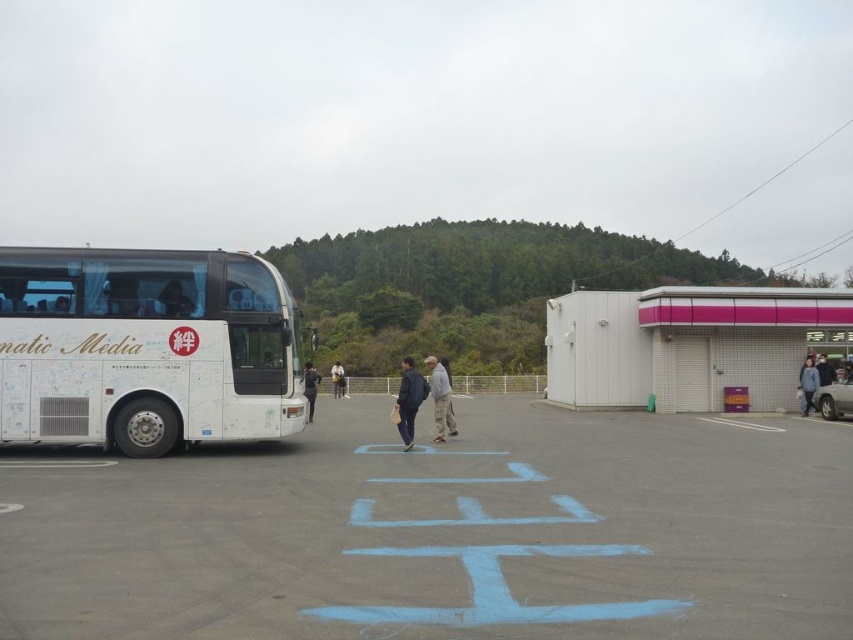
Which is more to the right, dark blue fabric jacket at center or dark gray fabric jacket at right?

From the viewer's perspective, dark gray fabric jacket at right appears more on the right side.

Which is more to the left, dark blue fabric jacket at center or dark gray fabric jacket at right?

dark blue fabric jacket at center is more to the left.

The width and height of the screenshot is (853, 640). I want to click on dark blue fabric jacket at center, so click(x=409, y=400).

Is white matte bus at left wider than black fabric jacket at center?

Correct, the width of white matte bus at left exceeds that of black fabric jacket at center.

Does white matte bus at left have a lesser width compared to black fabric jacket at center?

Incorrect, white matte bus at left's width is not less than black fabric jacket at center's.

Who is more forward, (74, 426) or (309, 388)?

Point (74, 426) is in front.

The width and height of the screenshot is (853, 640). I want to click on white matte bus at left, so click(x=144, y=348).

Between point (817, 461) and point (438, 408), which one is positioned in front?

Point (817, 461) is in front.

Which is above, white asphalt parking lot at center or gray camouflage pants at center?

gray camouflage pants at center is higher up.

Is point (570, 528) in front of point (434, 413)?

Yes, point (570, 528) is closer to viewer.

Where is `white asphalt parking lot at center`? The image size is (853, 640). white asphalt parking lot at center is located at coordinates (442, 531).